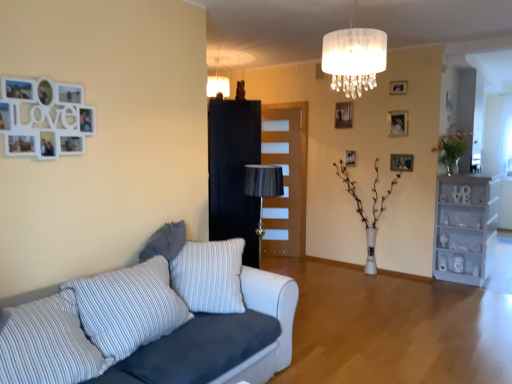
Question: Can we say wooden picture frame at upper right, which is the fifth picture frame in left-to-right order, lies outside translucent glass vase at right, which appears as the second plant when viewed from the left?

Choices:
 (A) no
 (B) yes

Answer: (B)

Question: Could you tell me if wooden picture frame at upper right, which is the fifth picture frame in left-to-right order, is turned towards translucent glass vase at right, which appears as the second plant when viewed from the left?

Choices:
 (A) yes
 (B) no

Answer: (B)

Question: Can you confirm if wooden picture frame at upper right, placed as the fifth picture frame when sorted from top to bottom, is smaller than translucent glass vase at right, the first plant from the right?

Choices:
 (A) no
 (B) yes

Answer: (B)

Question: Is wooden picture frame at upper right, which is the fifth picture frame in left-to-right order, shorter than translucent glass vase at right, marked as the 1th plant in a top-to-bottom arrangement?

Choices:
 (A) no
 (B) yes

Answer: (B)

Question: Does wooden picture frame at upper right, placed as the fifth picture frame when sorted from top to bottom, have a lesser width compared to translucent glass vase at right, marked as the 1th plant in a top-to-bottom arrangement?

Choices:
 (A) no
 (B) yes

Answer: (B)

Question: Relative to matte silver picture frame at upper right, the second picture frame viewed from the right, is wooden picture frame at upper center, which ranks as the fifth picture frame in bottom-to-top order, in front or behind?

Choices:
 (A) behind
 (B) front

Answer: (B)

Question: Based on their sizes in the image, would you say wooden picture frame at upper center, which ranks as the 3th picture frame in right-to-left order, is bigger or smaller than matte silver picture frame at upper right, which is the third picture frame in bottom-to-top order?

Choices:
 (A) small
 (B) big

Answer: (A)

Question: Is wooden picture frame at upper center, which ranks as the 3th picture frame in right-to-left order, wider or thinner than matte silver picture frame at upper right, the second picture frame viewed from the right?

Choices:
 (A) wide
 (B) thin

Answer: (A)

Question: From the image's perspective, is wooden picture frame at upper center, which ranks as the 3th picture frame in right-to-left order, located above or below matte silver picture frame at upper right, the second picture frame viewed from the right?

Choices:
 (A) below
 (B) above

Answer: (B)

Question: In terms of width, does brown wooden door at center look wider or thinner when compared to wooden picture frame at center, placed as the 2th picture frame when sorted from left to right?

Choices:
 (A) wide
 (B) thin

Answer: (A)

Question: Is brown wooden door at center spatially inside wooden picture frame at center, which appears as the 2th picture frame when ordered from the bottom, or outside of it?

Choices:
 (A) inside
 (B) outside

Answer: (B)

Question: From the image's perspective, relative to wooden picture frame at center, placed as the 2th picture frame when sorted from left to right, is brown wooden door at center above or below?

Choices:
 (A) above
 (B) below

Answer: (B)

Question: Is point (287, 163) closer or farther from the camera than point (353, 152)?

Choices:
 (A) closer
 (B) farther

Answer: (B)

Question: In terms of height, does wooden picture frame at center, arranged as the fourth picture frame when viewed from the right, look taller or shorter compared to white glossy vase at center, the 2th plant positioned from the right?

Choices:
 (A) tall
 (B) short

Answer: (B)

Question: Considering the positions of wooden picture frame at center, the fourth picture frame from the top, and white glossy vase at center, which ranks as the first plant in bottom-to-top order, in the image, is wooden picture frame at center, the fourth picture frame from the top, wider or thinner than white glossy vase at center, which ranks as the first plant in bottom-to-top order,?

Choices:
 (A) thin
 (B) wide

Answer: (A)